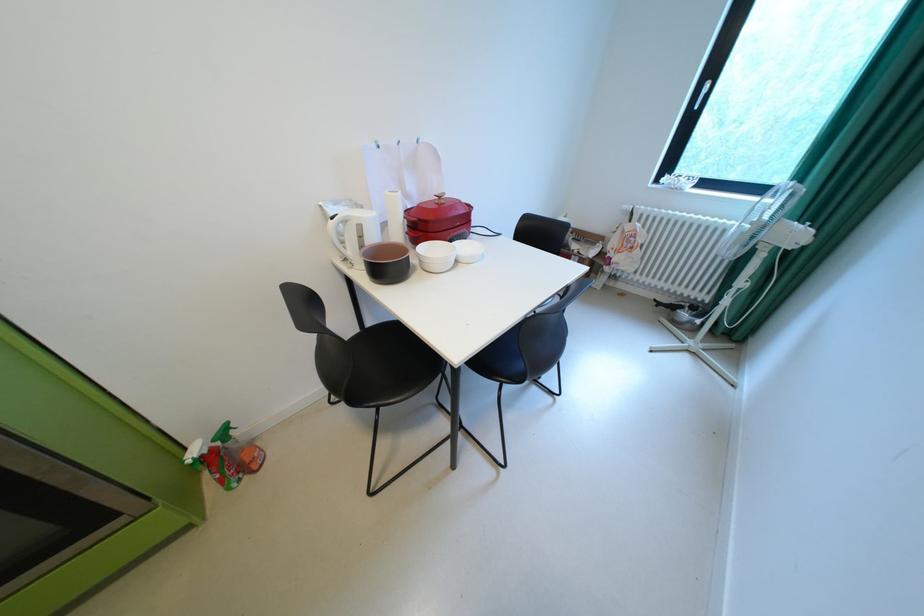
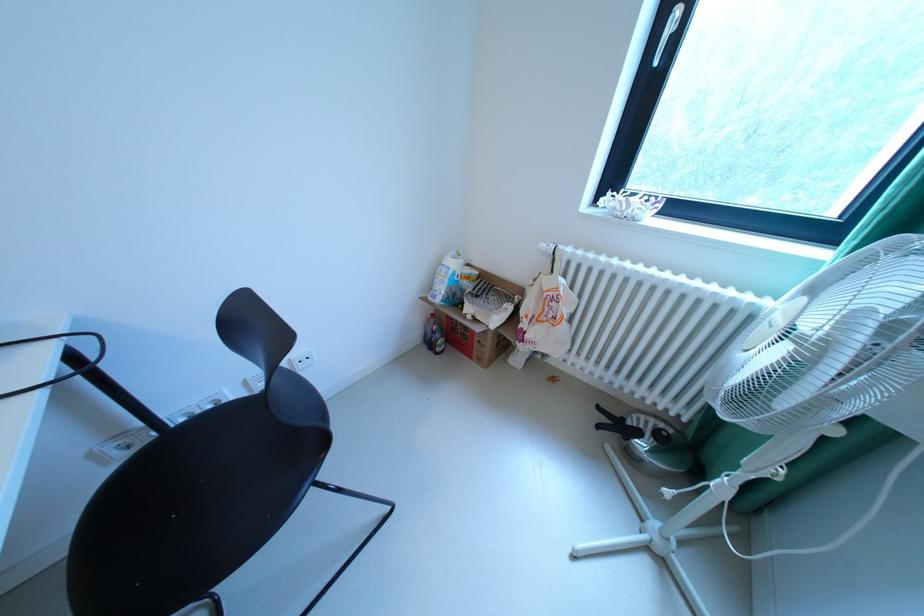
In the second image, find the point that corresponds to [639,246] in the first image.

(561, 317)